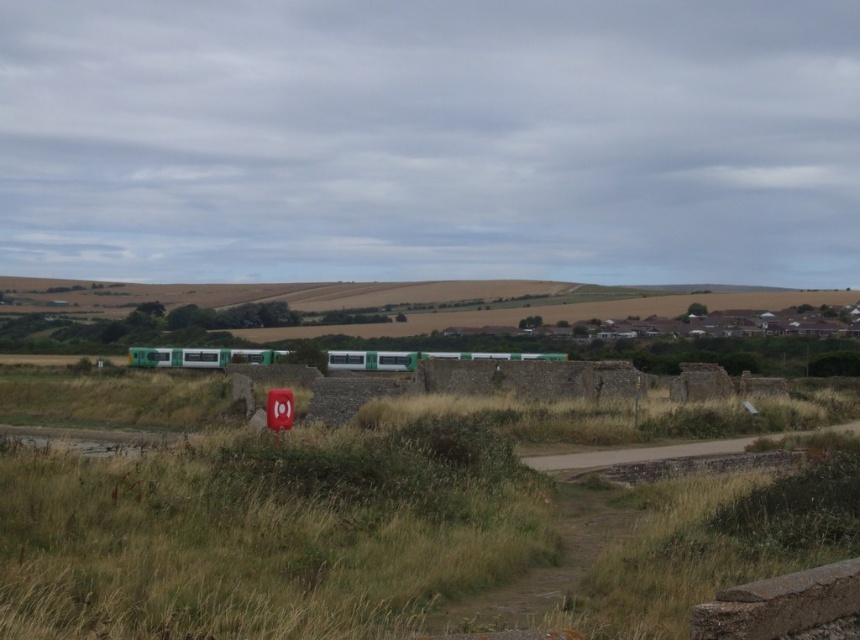
Does green matte passenger train at center have a greater width compared to dirt road at center?

Yes.

Between point (422, 353) and point (550, 467), which one is positioned behind?

The point (422, 353) is behind.

Who is more forward, (459, 352) or (751, 438)?

Point (751, 438)

Where is `green matte passenger train at center`? green matte passenger train at center is located at coordinates (418, 358).

Is green matte passenger train at center to the left of smooth plastic sign at center from the viewer's perspective?

Indeed, green matte passenger train at center is positioned on the left side of smooth plastic sign at center.

Can you confirm if green matte passenger train at center is bigger than smooth plastic sign at center?

Yes, green matte passenger train at center is bigger than smooth plastic sign at center.

Is point (195, 365) positioned in front of point (271, 419)?

No.

This screenshot has height=640, width=860. I want to click on green matte passenger train at center, so click(x=418, y=358).

Is point (711, 452) in front of point (280, 435)?

No, (711, 452) is behind (280, 435).

Consider the image. Between dirt road at center and smooth plastic sign at center, which one is positioned higher?

smooth plastic sign at center

Which is behind, point (659, 452) or point (272, 428)?

The point (659, 452) is more distant.

Identify the location of dirt road at center. The height and width of the screenshot is (640, 860). (645, 452).